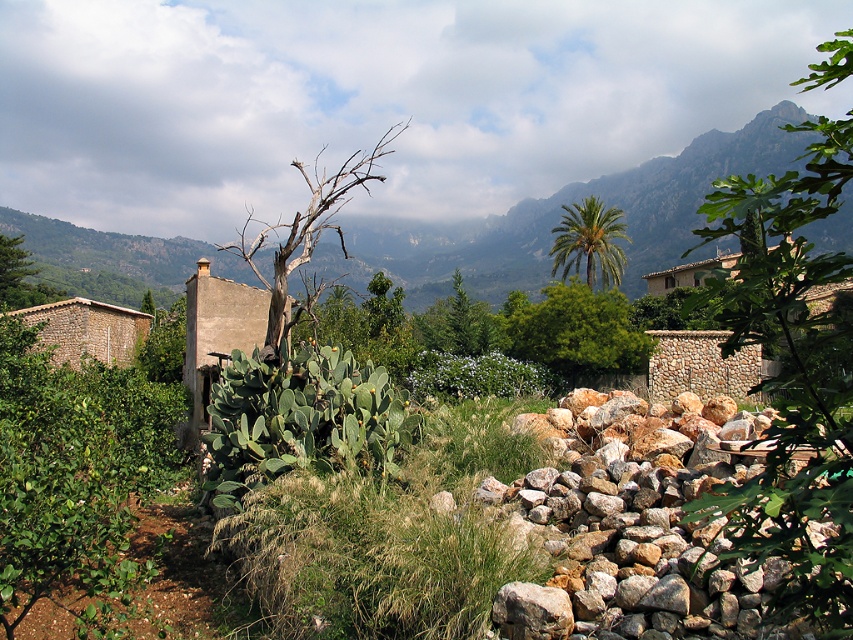
Is point (209, 291) in front of point (97, 355)?

Yes, point (209, 291) is closer to viewer.

This screenshot has height=640, width=853. What do you see at coordinates (218, 332) in the screenshot?
I see `beige stone hut at center` at bounding box center [218, 332].

You are a GUI agent. You are given a task and a screenshot of the screen. Output one action in this format:
    pyautogui.click(x=<x>, y=<y>)
    Task: Click on the beige stone hut at center
    
    Given the screenshot: What is the action you would take?
    pyautogui.click(x=218, y=332)

Who is higher up, green leafy tree at right or green leafy tree at center?

Positioned higher is green leafy tree at right.

Who is more distant from viewer, (848,179) or (614,346)?

The point (614,346) is more distant.

Does point (782, 506) come behind point (608, 305)?

No, it is in front of (608, 305).

I want to click on green leafy tree at right, so click(792, 376).

Is beige stone hut at center below green leafy palm at upper center?

Correct, beige stone hut at center is located below green leafy palm at upper center.

The width and height of the screenshot is (853, 640). I want to click on beige stone hut at center, so click(x=218, y=332).

Is point (212, 307) closer to viewer compared to point (561, 230)?

Yes, it is.

Locate an element on the screen. beige stone hut at center is located at coordinates [218, 332].